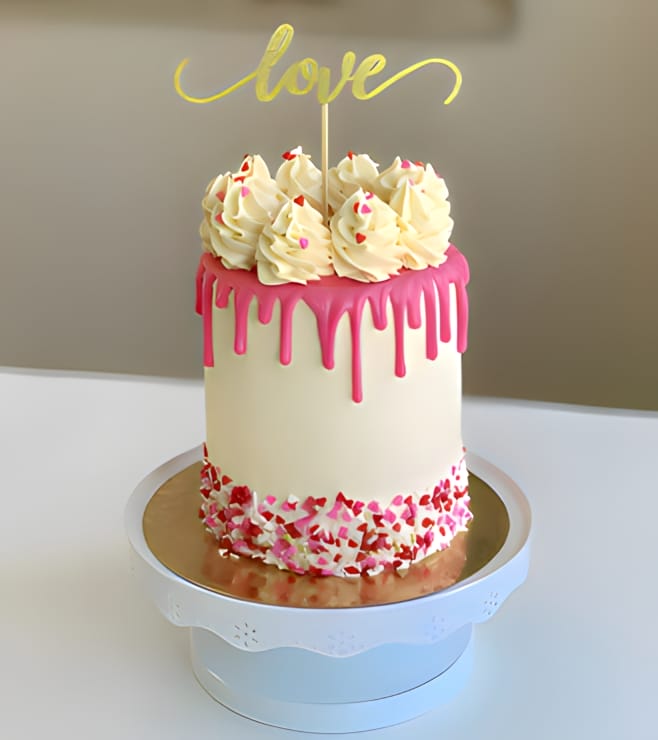
The image size is (658, 740). I want to click on wall, so click(x=587, y=235), click(x=299, y=84), click(x=116, y=74).